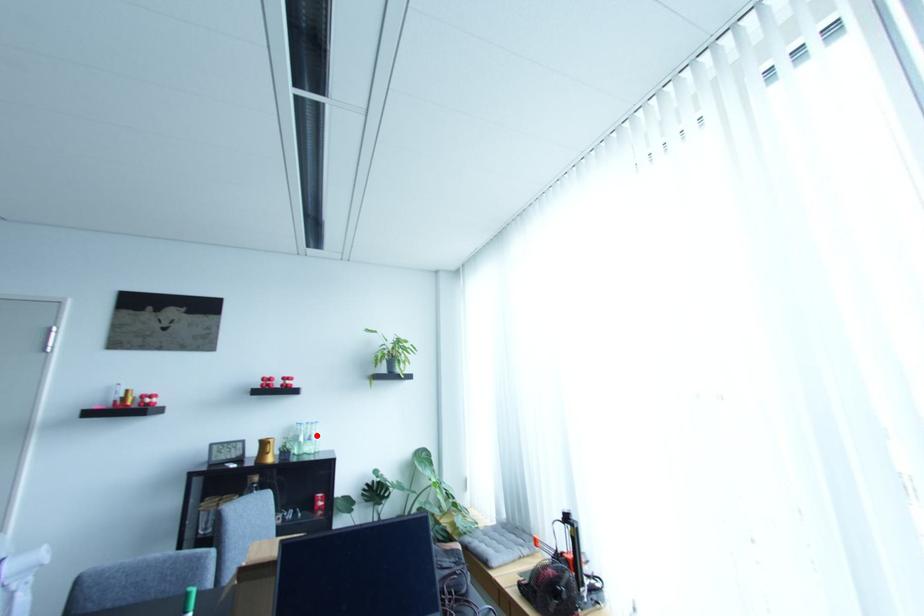
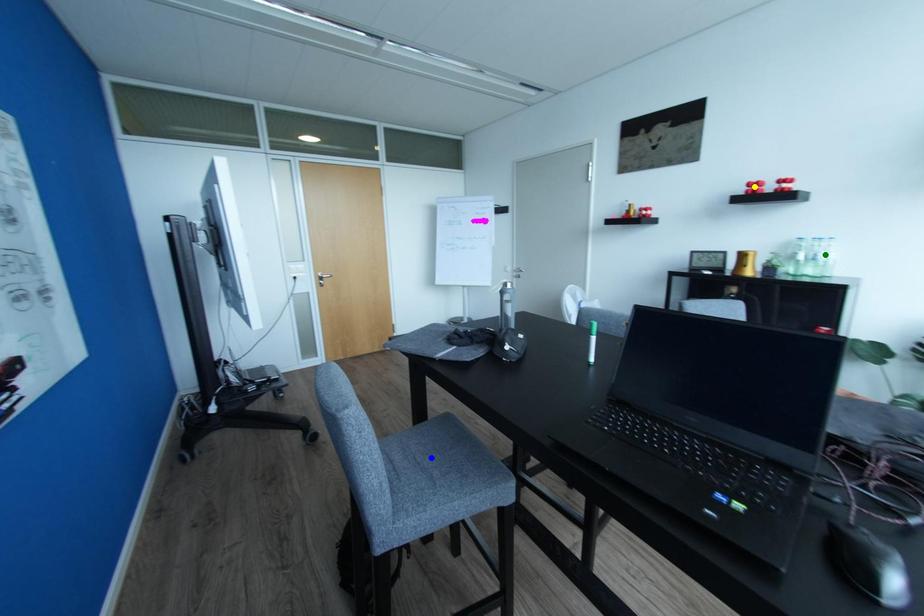
Question: I am providing you with two images of the same scene from different viewpoints. A red point is marked on the first image. You are given multiple points on the second image. Can you choose the point in image 2 that corresponds to the point in image 1?

Choices:
 (A) yellow point
 (B) blue point
 (C) green point

Answer: (C)